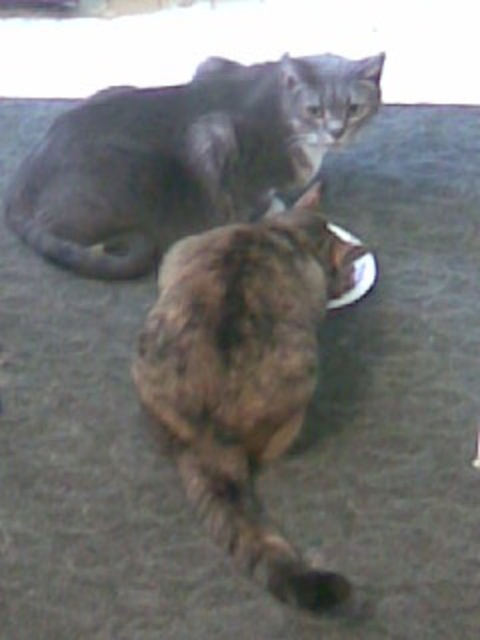
Question: Does gray fur cat at upper center appear over metallic reflective plate at center?

Choices:
 (A) yes
 (B) no

Answer: (A)

Question: Is gray fur cat at upper center in front of brown fur cat at center?

Choices:
 (A) no
 (B) yes

Answer: (A)

Question: Based on their relative distances, which object is farther from the gray fur cat at upper center?

Choices:
 (A) brown fur cat at center
 (B) metallic reflective plate at center

Answer: (B)

Question: Can you confirm if gray fur cat at upper center is smaller than brown fur cat at center?

Choices:
 (A) no
 (B) yes

Answer: (B)

Question: Which object is farther from the camera taking this photo?

Choices:
 (A) brown fur cat at center
 (B) gray fur cat at upper center
 (C) metallic reflective plate at center

Answer: (B)

Question: Which of the following is the closest to the observer?

Choices:
 (A) (72, 108)
 (B) (351, 291)

Answer: (B)